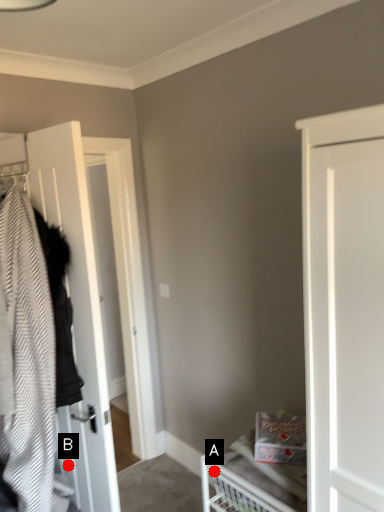
Question: Two points are circled on the image, labeled by A and B beside each circle. Which point is farther from the camera taking this photo?

Choices:
 (A) A is further
 (B) B is further

Answer: (B)